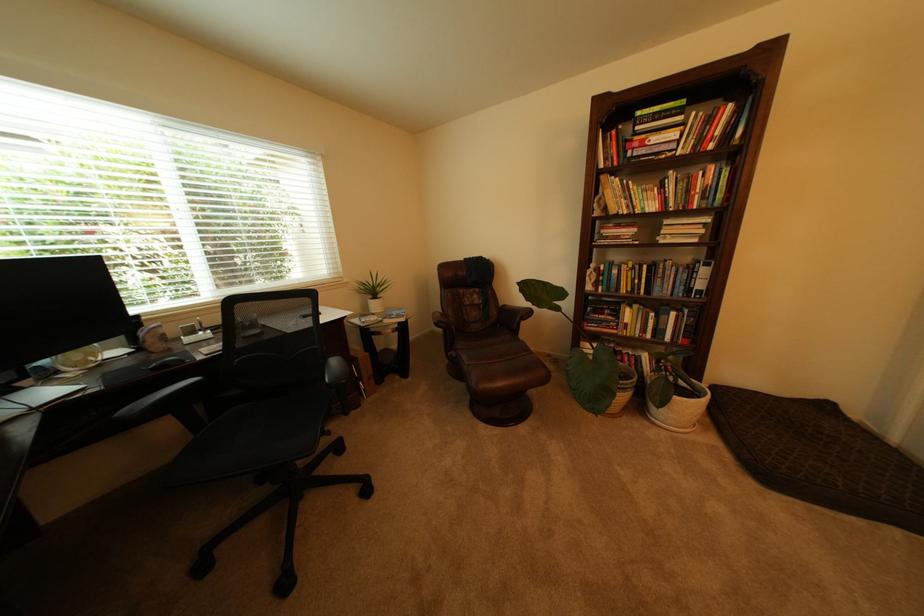
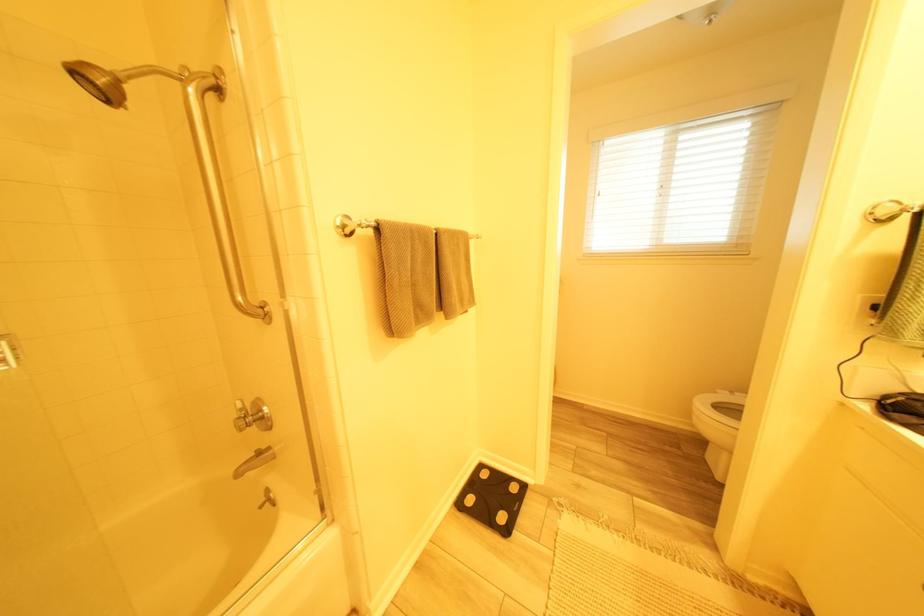
Which direction would the cameraman need to move to produce the second image?

The movement direction of the cameraman is right, backward.